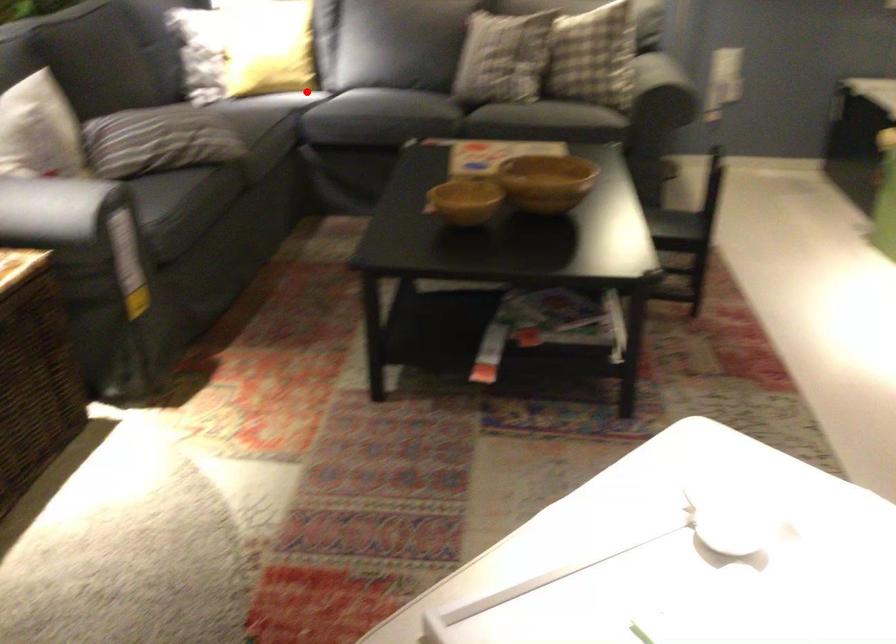
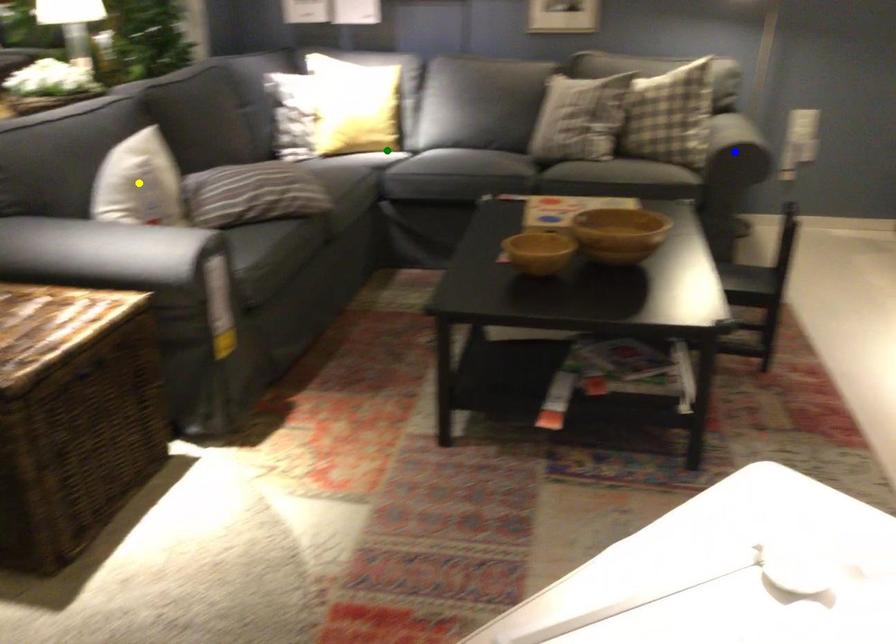
Question: I am providing you with two images of the same scene from different viewpoints. A red point is marked on the first image. You are given multiple points on the second image. Which mark in image 2 goes with the point in image 1?

Choices:
 (A) blue point
 (B) green point
 (C) yellow point

Answer: (B)